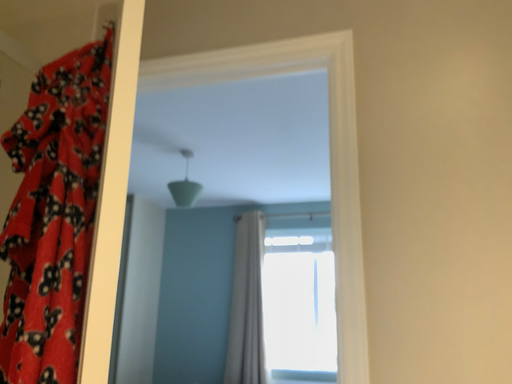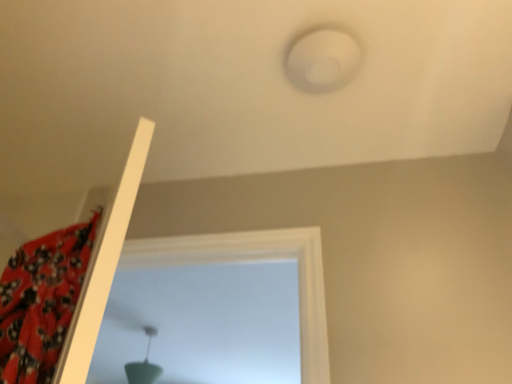
Question: How did the camera likely rotate when shooting the video?

Choices:
 (A) rotated downward
 (B) rotated upward

Answer: (B)